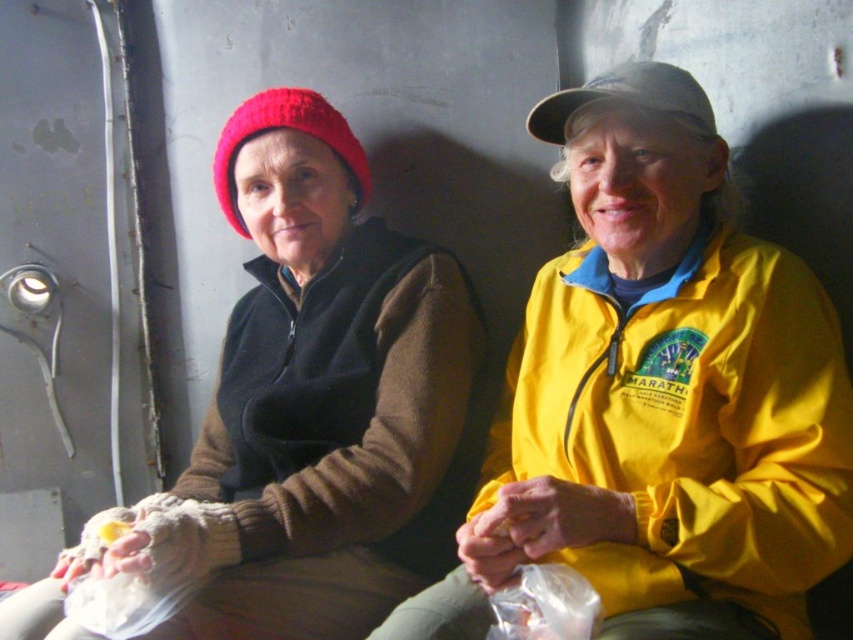
Question: Which point is farther from the camera taking this photo?

Choices:
 (A) (223, 168)
 (B) (532, 131)

Answer: (A)

Question: Is knitted red beanie at upper left above yellow soft bread at lower left?

Choices:
 (A) no
 (B) yes

Answer: (B)

Question: Is knitted woolen beanie at upper left bigger than transparent plastic bag at lower center?

Choices:
 (A) no
 (B) yes

Answer: (B)

Question: Which object appears farthest from the camera in this image?

Choices:
 (A) yellow matte jacket at center
 (B) knitted woolen beanie at upper left
 (C) transparent plastic bag at lower center

Answer: (B)

Question: Is yellow matte jacket at center above transparent plastic bag at lower center?

Choices:
 (A) yes
 (B) no

Answer: (A)

Question: Among these objects, which one is farthest from the camera?

Choices:
 (A) yellow soft bread at lower left
 (B) knitted red beanie at upper left

Answer: (A)